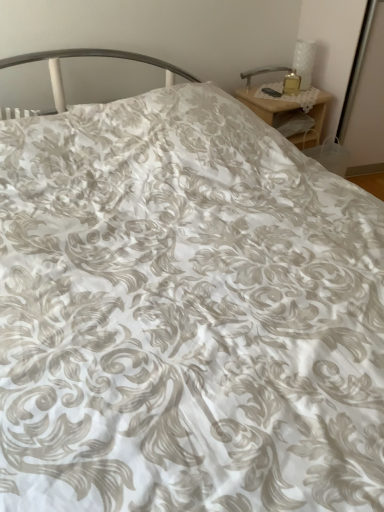
The width and height of the screenshot is (384, 512). I want to click on white textured vase at upper right, acting as the first table lamp starting from the right, so click(x=304, y=61).

Identify the location of the 2nd table lamp directly above the wooden nightstand at upper right (from a real-world perspective). (304, 61).

Looking at this image, is white textured vase at upper right, acting as the 2th table lamp starting from the left, touching wooden nightstand at upper right?

white textured vase at upper right, acting as the 2th table lamp starting from the left, and wooden nightstand at upper right are clearly separated.

Is white textured vase at upper right, acting as the first table lamp starting from the right, thinner than wooden nightstand at upper right?

Correct, the width of white textured vase at upper right, acting as the first table lamp starting from the right, is less than that of wooden nightstand at upper right.

From a real-world perspective, between white textured vase at upper right, acting as the first table lamp starting from the right, and wooden nightstand at upper right, who is vertically lower?

wooden nightstand at upper right.

Which of these two, wooden nightstand at upper right or metallic silver table lamp at upper right, marked as the 1th table lamp in a left-to-right arrangement, is bigger?

With larger size is wooden nightstand at upper right.

From a real-world perspective, which object rests below the other?

wooden nightstand at upper right.

From the image's perspective, is wooden nightstand at upper right under metallic silver table lamp at upper right, marked as the 1th table lamp in a left-to-right arrangement?

Yes, from the image's perspective, wooden nightstand at upper right is beneath metallic silver table lamp at upper right, marked as the 1th table lamp in a left-to-right arrangement.

From the image's perspective, which one is positioned higher, wooden nightstand at upper right or white textured vase at upper right, acting as the first table lamp starting from the right?

white textured vase at upper right, acting as the first table lamp starting from the right, is shown above in the image.

Identify the location of the 1st table lamp behind the wooden nightstand at upper right, counting from the anchor's position. (304, 61).

Considering their positions, is wooden nightstand at upper right located in front of or behind white textured vase at upper right, acting as the 2th table lamp starting from the left?

wooden nightstand at upper right is in front of white textured vase at upper right, acting as the 2th table lamp starting from the left.

From a real-world perspective, which object stands above the other?

white textured vase at upper right, acting as the 2th table lamp starting from the left.

Which object is thinner, metallic silver table lamp at upper right, which is the 2th table lamp from right to left, or white textured vase at upper right, acting as the first table lamp starting from the right?

Thinner between the two is metallic silver table lamp at upper right, which is the 2th table lamp from right to left.

Could you tell me if metallic silver table lamp at upper right, marked as the 1th table lamp in a left-to-right arrangement, is facing white textured vase at upper right, acting as the 2th table lamp starting from the left?

No, metallic silver table lamp at upper right, marked as the 1th table lamp in a left-to-right arrangement, is not turned towards white textured vase at upper right, acting as the 2th table lamp starting from the left.

Considering the relative sizes of metallic silver table lamp at upper right, marked as the 1th table lamp in a left-to-right arrangement, and white textured vase at upper right, acting as the first table lamp starting from the right, in the image provided, is metallic silver table lamp at upper right, marked as the 1th table lamp in a left-to-right arrangement, shorter than white textured vase at upper right, acting as the first table lamp starting from the right,?

Indeed, metallic silver table lamp at upper right, marked as the 1th table lamp in a left-to-right arrangement, has a lesser height compared to white textured vase at upper right, acting as the first table lamp starting from the right.

Are metallic silver table lamp at upper right, which is the 2th table lamp from right to left, and white textured vase at upper right, acting as the 2th table lamp starting from the left, beside each other?

metallic silver table lamp at upper right, which is the 2th table lamp from right to left, and white textured vase at upper right, acting as the 2th table lamp starting from the left, are clearly separated.

Looking at this image, from a real-world perspective, between metallic silver table lamp at upper right, marked as the 1th table lamp in a left-to-right arrangement, and wooden nightstand at upper right, who is vertically higher?

metallic silver table lamp at upper right, marked as the 1th table lamp in a left-to-right arrangement.

From their relative heights in the image, would you say metallic silver table lamp at upper right, which is the 2th table lamp from right to left, is taller or shorter than wooden nightstand at upper right?

Considering their sizes, metallic silver table lamp at upper right, which is the 2th table lamp from right to left, has less height than wooden nightstand at upper right.

Does white textured vase at upper right, acting as the 2th table lamp starting from the left, have a lesser height compared to metallic silver table lamp at upper right, marked as the 1th table lamp in a left-to-right arrangement?

In fact, white textured vase at upper right, acting as the 2th table lamp starting from the left, may be taller than metallic silver table lamp at upper right, marked as the 1th table lamp in a left-to-right arrangement.

From the picture: From a real-world perspective, which is physically above, white textured vase at upper right, acting as the 2th table lamp starting from the left, or metallic silver table lamp at upper right, marked as the 1th table lamp in a left-to-right arrangement?

white textured vase at upper right, acting as the 2th table lamp starting from the left, is physically above.

Is point (312, 42) positioned before point (247, 76)?

No, (312, 42) is behind (247, 76).

Can you tell me how much white textured vase at upper right, acting as the first table lamp starting from the right, and metallic silver table lamp at upper right, marked as the 1th table lamp in a left-to-right arrangement, differ in facing direction?

The angle between the facing direction of white textured vase at upper right, acting as the first table lamp starting from the right, and the facing direction of metallic silver table lamp at upper right, marked as the 1th table lamp in a left-to-right arrangement, is 0.846 degrees.

Image resolution: width=384 pixels, height=512 pixels. What are the coordinates of `nightstand on the left of white textured vase at upper right, acting as the first table lamp starting from the right` in the screenshot? It's located at pyautogui.click(x=269, y=106).

There is a wooden nightstand at upper right. Identify the location of the 1st table lamp above it (from the image's perspective). This screenshot has height=512, width=384. (264, 72).

From the image, which object appears to be nearer to metallic silver table lamp at upper right, marked as the 1th table lamp in a left-to-right arrangement, wooden nightstand at upper right or white textured vase at upper right, acting as the 2th table lamp starting from the left?

white textured vase at upper right, acting as the 2th table lamp starting from the left, lies closer to metallic silver table lamp at upper right, marked as the 1th table lamp in a left-to-right arrangement, than the other object.

When comparing their distances from white textured vase at upper right, acting as the 2th table lamp starting from the left, does metallic silver table lamp at upper right, which is the 2th table lamp from right to left, or wooden nightstand at upper right seem closer?

metallic silver table lamp at upper right, which is the 2th table lamp from right to left, lies closer to white textured vase at upper right, acting as the 2th table lamp starting from the left, than the other object.

Considering their positions, is white textured vase at upper right, acting as the 2th table lamp starting from the left, positioned further to metallic silver table lamp at upper right, which is the 2th table lamp from right to left, than wooden nightstand at upper right?

wooden nightstand at upper right lies further to metallic silver table lamp at upper right, which is the 2th table lamp from right to left, than the other object.

When comparing their distances from white textured vase at upper right, acting as the first table lamp starting from the right, does wooden nightstand at upper right or metallic silver table lamp at upper right, marked as the 1th table lamp in a left-to-right arrangement, seem closer?

metallic silver table lamp at upper right, marked as the 1th table lamp in a left-to-right arrangement, is closer to white textured vase at upper right, acting as the first table lamp starting from the right.

Based on their spatial positions, is white textured vase at upper right, acting as the 2th table lamp starting from the left, or metallic silver table lamp at upper right, marked as the 1th table lamp in a left-to-right arrangement, closer to wooden nightstand at upper right?

metallic silver table lamp at upper right, marked as the 1th table lamp in a left-to-right arrangement, lies closer to wooden nightstand at upper right than the other object.

Estimate the real-world distances between objects in this image. Which object is closer to wooden nightstand at upper right, metallic silver table lamp at upper right, which is the 2th table lamp from right to left, or white textured vase at upper right, acting as the 2th table lamp starting from the left?

metallic silver table lamp at upper right, which is the 2th table lamp from right to left, is closer to wooden nightstand at upper right.

In order to click on table lamp between white textured vase at upper right, acting as the 2th table lamp starting from the left, and wooden nightstand at upper right from top to bottom in this screenshot , I will do `click(264, 72)`.